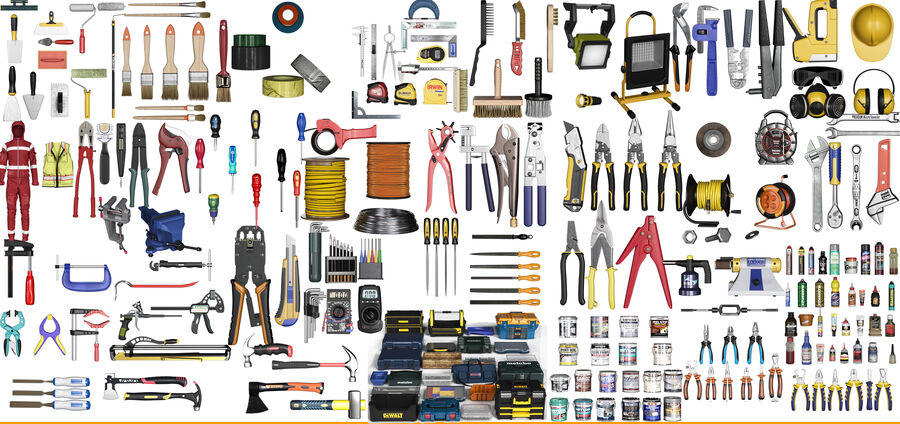
This screenshot has height=424, width=900. In order to click on adhesive tape in this screenshot , I will do `click(243, 65)`, `click(243, 42)`, `click(291, 20)`, `click(307, 64)`, `click(294, 83)`, `click(325, 147)`.